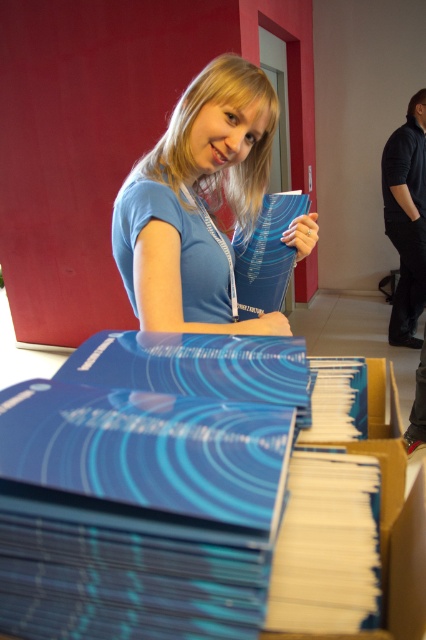
Question: Can you confirm if blue glossy book at lower center is bigger than blue matte book at center?

Choices:
 (A) yes
 (B) no

Answer: (B)

Question: Among these points, which one is farthest from the camera?

Choices:
 (A) (209, 173)
 (B) (264, 225)

Answer: (B)

Question: Is blue glossy book at lower center bigger than blue glossy book at lower right?

Choices:
 (A) yes
 (B) no

Answer: (A)

Question: Is blue glossy book at lower center bigger than blue matte book at center?

Choices:
 (A) yes
 (B) no

Answer: (B)

Question: Which point is farther to the camera?

Choices:
 (A) (213, 412)
 (B) (187, 291)
 (C) (325, 476)
 (D) (298, 208)

Answer: (D)

Question: Which of the following is the farthest from the observer?

Choices:
 (A) (279, 252)
 (B) (282, 609)

Answer: (A)